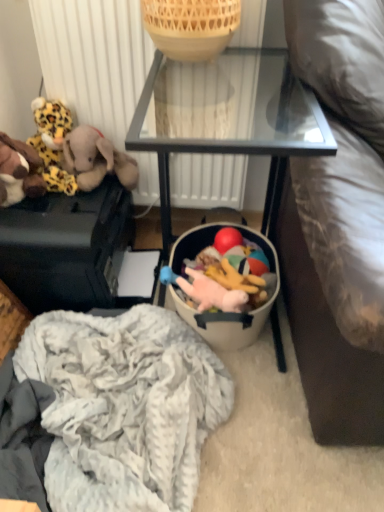
Question: Should I look upward or downward to see rubber ball at center, acting as the first toy starting from the right?

Choices:
 (A) up
 (B) down

Answer: (A)

Question: Is matte black suitcase at left, arranged as the 1th furniture when viewed from the left, not close to black glass table at center, which appears as the 1th furniture when viewed from the right?

Choices:
 (A) yes
 (B) no

Answer: (B)

Question: Is matte black suitcase at left, arranged as the 1th furniture when viewed from the left, to the right of black glass table at center, which is the second furniture in left-to-right order, from the viewer's perspective?

Choices:
 (A) no
 (B) yes

Answer: (A)

Question: Does matte black suitcase at left, the second furniture positioned from the right, come in front of black glass table at center, which is the second furniture in left-to-right order?

Choices:
 (A) yes
 (B) no

Answer: (B)

Question: From the image's perspective, is matte black suitcase at left, the second furniture positioned from the right, below black glass table at center, which appears as the 1th furniture when viewed from the right?

Choices:
 (A) no
 (B) yes

Answer: (B)

Question: Is matte black suitcase at left, the second furniture positioned from the right, shorter than black glass table at center, which is the second furniture in left-to-right order?

Choices:
 (A) no
 (B) yes

Answer: (B)

Question: Does matte black suitcase at left, arranged as the 1th furniture when viewed from the left, lie behind black glass table at center, which is the second furniture in left-to-right order?

Choices:
 (A) no
 (B) yes

Answer: (B)

Question: Would you say leopard print plush at left, the second toy viewed from the left, is outside black glass table at center, which appears as the 1th furniture when viewed from the right?

Choices:
 (A) no
 (B) yes

Answer: (B)

Question: Is leopard print plush at left, the second toy viewed from the left, positioned far away from black glass table at center, which is the second furniture in left-to-right order?

Choices:
 (A) yes
 (B) no

Answer: (B)

Question: Is leopard print plush at left, the second toy viewed from the left, beside black glass table at center, which is the second furniture in left-to-right order?

Choices:
 (A) no
 (B) yes

Answer: (A)

Question: Is leopard print plush at left, the second toy viewed from the left, positioned in front of black glass table at center, which is the second furniture in left-to-right order?

Choices:
 (A) yes
 (B) no

Answer: (B)

Question: Considering the relative sizes of leopard print plush at left, the second toy viewed from the left, and black glass table at center, which appears as the 1th furniture when viewed from the right, in the image provided, is leopard print plush at left, the second toy viewed from the left, bigger than black glass table at center, which appears as the 1th furniture when viewed from the right,?

Choices:
 (A) yes
 (B) no

Answer: (B)

Question: Considering the relative sizes of leopard print plush at left, the second toy viewed from the left, and black glass table at center, which is the second furniture in left-to-right order, in the image provided, is leopard print plush at left, the second toy viewed from the left, smaller than black glass table at center, which is the second furniture in left-to-right order,?

Choices:
 (A) no
 (B) yes

Answer: (B)

Question: From a real-world perspective, is rubber ball at center, acting as the first toy starting from the right, positioned over matte black suitcase at left, arranged as the 1th furniture when viewed from the left, based on gravity?

Choices:
 (A) no
 (B) yes

Answer: (B)